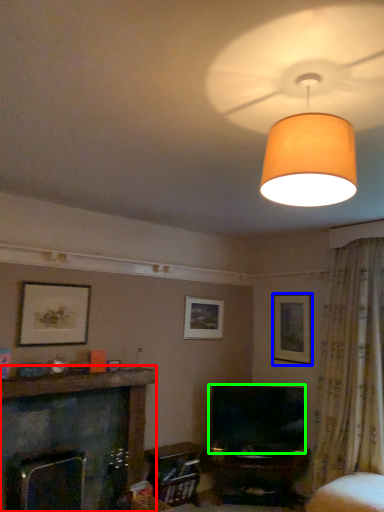
Question: Which object is positioned closest to fireplace (highlighted by a red box)? Select from picture frame (highlighted by a blue box) and television (highlighted by a green box).

Choices:
 (A) picture frame
 (B) television

Answer: (B)